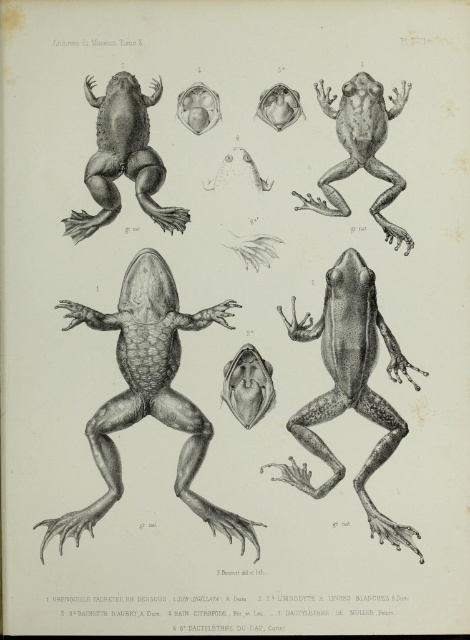
You are a researcher examining the frog anatomy illustration. You notice two points labeled in the image. The first point is at coordinate point(220, 305) and the second is at point(335, 298). Based on their positions in the illustration, which point is closer to the viewer?

Point(220, 305) is in front of point(335, 298), so it is closer to the viewer.